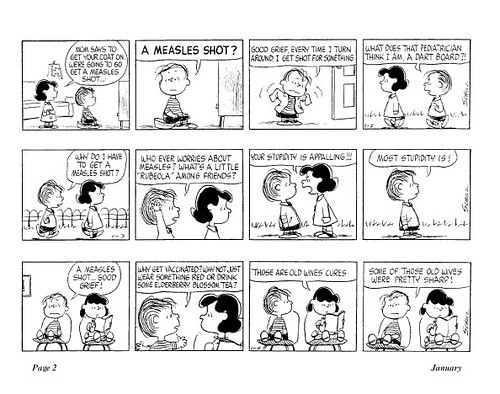
The height and width of the screenshot is (394, 500). I want to click on chair, so click(68, 324), click(83, 324), click(297, 324), click(199, 337), click(311, 319), click(410, 329), click(428, 321).